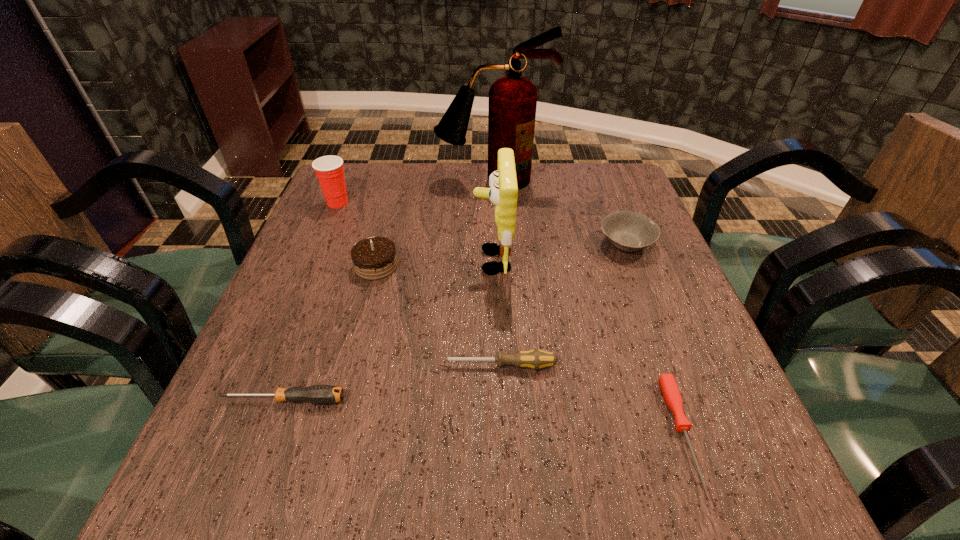
I want to click on free space between the third tallest object and the fourth shortest object, so click(x=482, y=224).

I want to click on free space between the leftmost screwdriver and the fourth tallest object, so click(x=330, y=333).

The height and width of the screenshot is (540, 960). I want to click on free space between the leftmost screwdriver and the seventh nearest object, so click(311, 301).

The image size is (960, 540). Find the location of `empty space between the rightmost screwdriver and the Dixie cup`. empty space between the rightmost screwdriver and the Dixie cup is located at coordinates (510, 317).

Where is `unoccupied position between the fifth shortest object and the seventh nearest object`? unoccupied position between the fifth shortest object and the seventh nearest object is located at coordinates (357, 234).

Image resolution: width=960 pixels, height=540 pixels. Find the location of `vacant space that is in between the fifth shortest object and the shortest screwdriver`. vacant space that is in between the fifth shortest object and the shortest screwdriver is located at coordinates (529, 349).

Find the location of `vacant point located between the rightmost screwdriver and the Dixie cup`. vacant point located between the rightmost screwdriver and the Dixie cup is located at coordinates (510, 317).

Image resolution: width=960 pixels, height=540 pixels. In order to click on free space between the second tallest object and the rightmost screwdriver in this screenshot , I will do `click(587, 346)`.

Locate an element on the screen. This screenshot has height=540, width=960. vacant point located between the Dixie cup and the farthest object is located at coordinates (416, 191).

Select which object is the seventh closest to the farthest screwdriver. Please provide its 2D coordinates. Your answer should be formatted as a tuple, i.e. [(x, y)], where the tuple contains the x and y coordinates of a point satisfying the conditions above.

[(512, 104)]